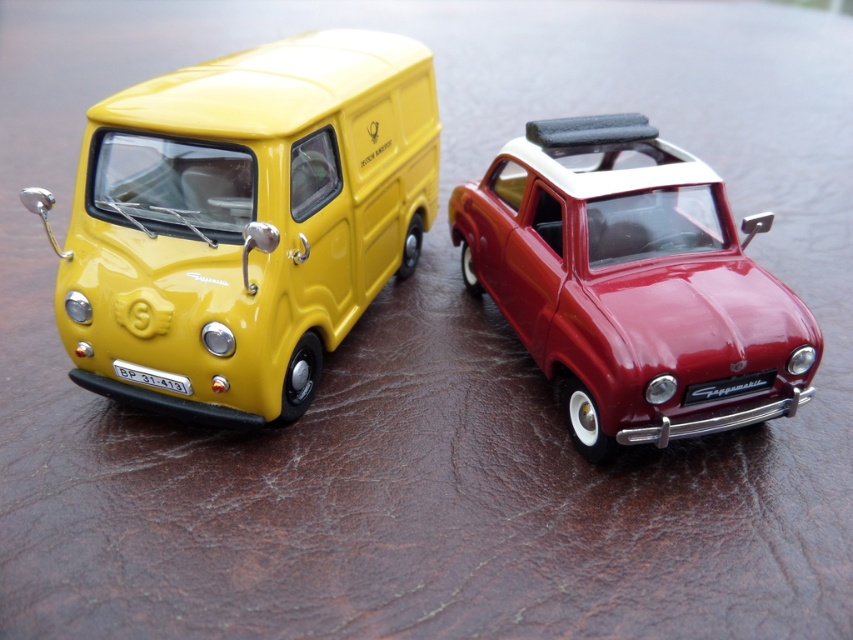
You are a collector who wants to place a new model car between the yellow glossy van at left and the shiny red car at center. The new car is 15 centimeters long. Do you think there will be enough space between them to fit the new car?

The yellow glossy van at left is 43.33 centimeters from the shiny red car at center. Since the distance between them is greater than the new car length of 15 centimeters, there will be enough space to fit the new car between them.